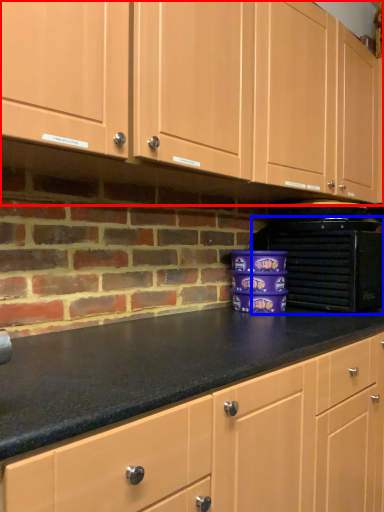
Question: Which point is further to the camera, cabinetry (highlighted by a red box) or home appliance (highlighted by a blue box)?

Choices:
 (A) cabinetry
 (B) home appliance

Answer: (B)